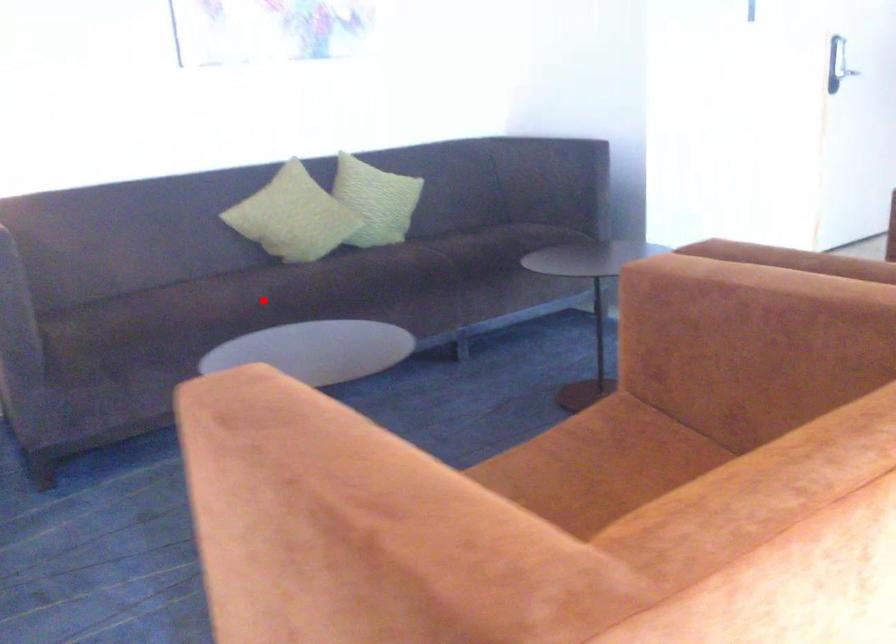
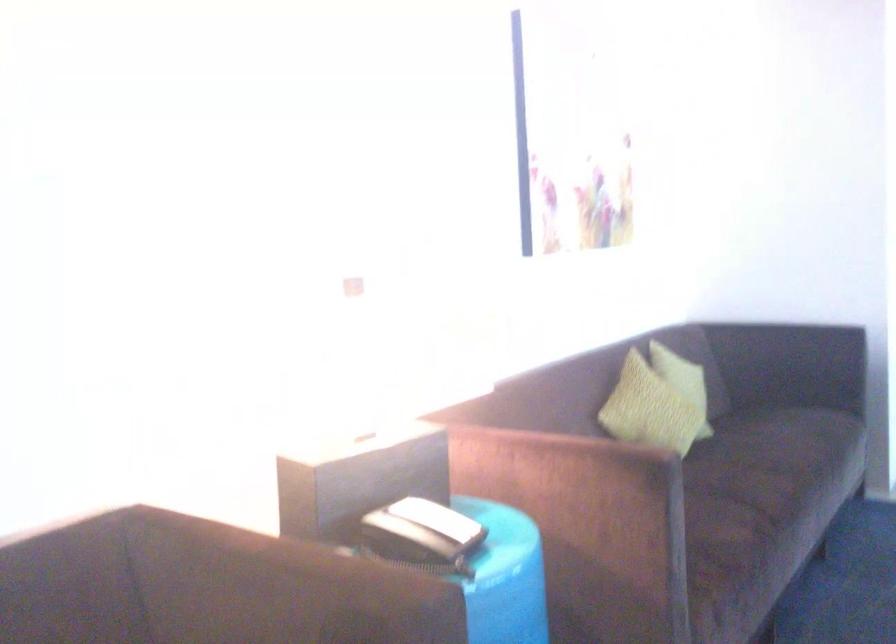
Question: I am providing you with two images of the same scene from different viewpoints. In image1, a red point is highlighted. Considering the same 3D point in image2, which of the following is correct?

Choices:
 (A) It is closer
 (B) It is farther

Answer: (A)